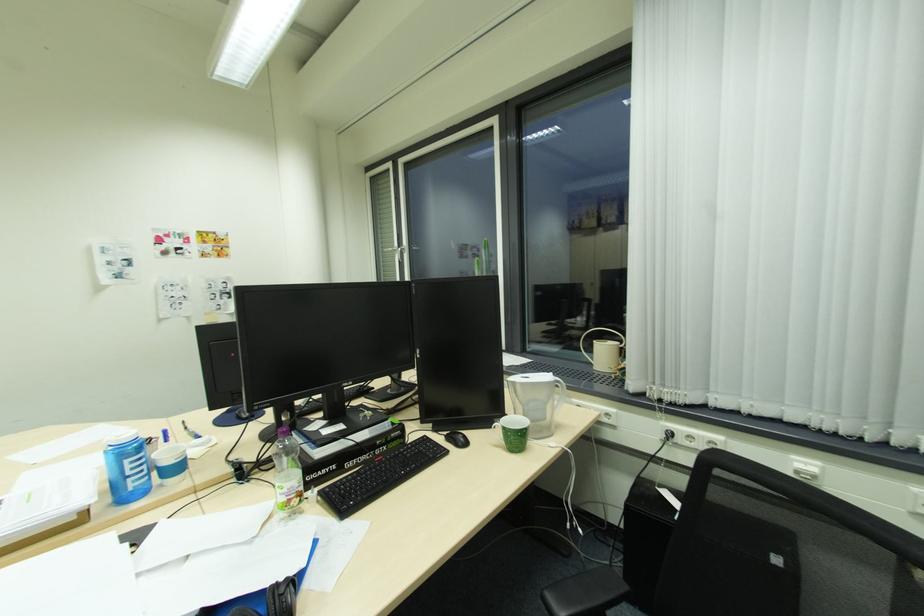
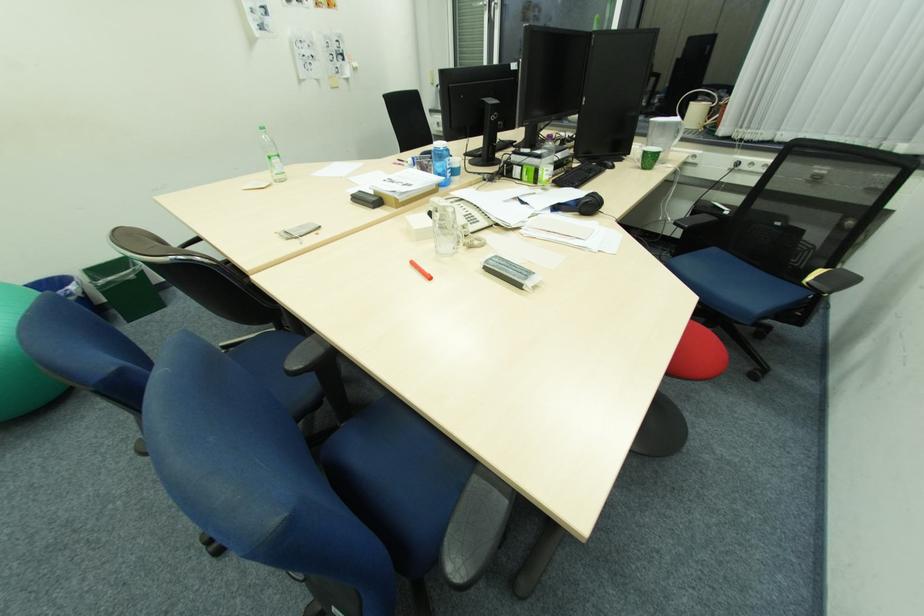
Where in the second image is the point corresponding to the point at 508,428 from the first image?

(650, 153)